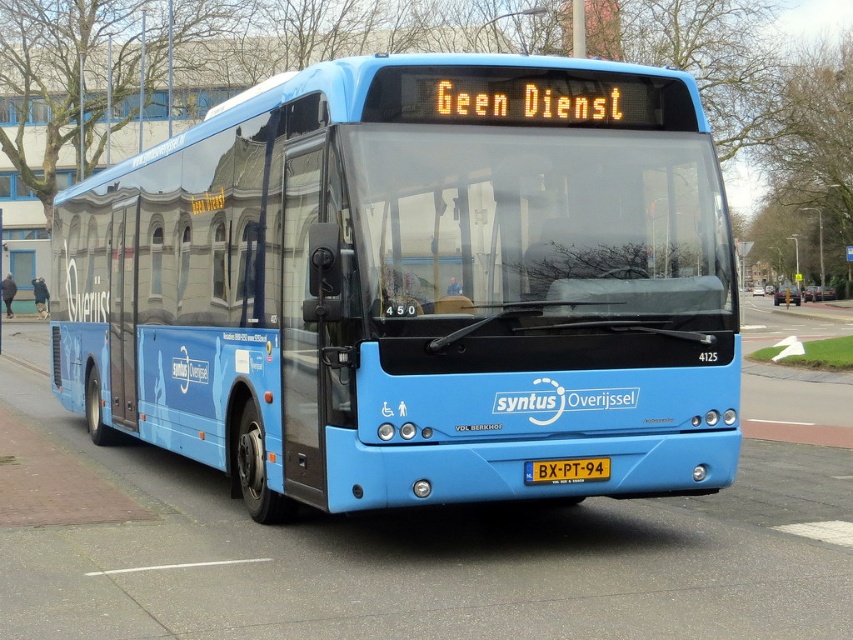
Question: Does matte blue bus at center appear over yellow metallic license plate at center?

Choices:
 (A) yes
 (B) no

Answer: (A)

Question: Among these objects, which one is farthest from the camera?

Choices:
 (A) matte blue bus at center
 (B) yellow metallic license plate at center

Answer: (B)

Question: Among these points, which one is farthest from the camera?

Choices:
 (A) (607, 461)
 (B) (326, 236)

Answer: (A)

Question: Does matte blue bus at center appear over yellow metallic license plate at center?

Choices:
 (A) yes
 (B) no

Answer: (A)

Question: Is the position of matte blue bus at center more distant than that of yellow metallic license plate at center?

Choices:
 (A) no
 (B) yes

Answer: (A)